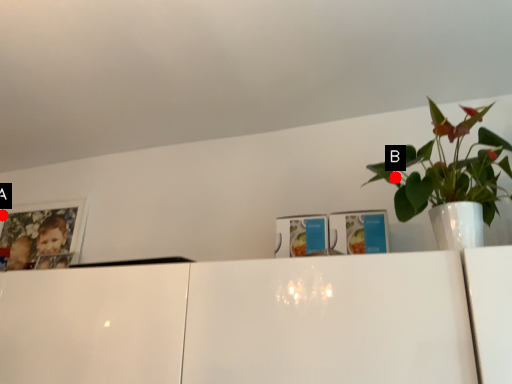
Question: Two points are circled on the image, labeled by A and B beside each circle. Which point is closer to the camera?

Choices:
 (A) A is closer
 (B) B is closer

Answer: (B)